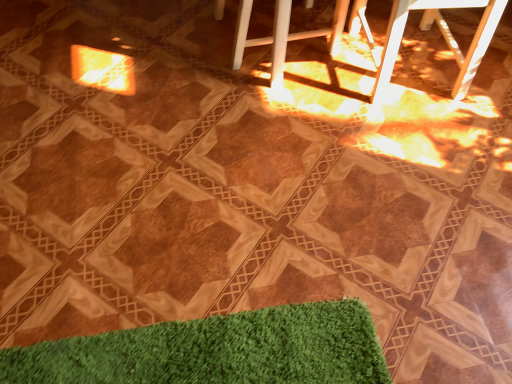
Question: Is white plastic bar stool at center, marked as the 2th bar stool in a right-to-left arrangement, taller or shorter than white plastic bar stool at upper right, placed as the second bar stool when sorted from left to right?

Choices:
 (A) short
 (B) tall

Answer: (A)

Question: Looking at the image, does white plastic bar stool at center, marked as the 2th bar stool in a right-to-left arrangement, seem bigger or smaller compared to white plastic bar stool at upper right, which is the first bar stool from right to left?

Choices:
 (A) big
 (B) small

Answer: (B)

Question: Does point coord(273,36) appear closer or farther from the camera than point coord(449,29)?

Choices:
 (A) farther
 (B) closer

Answer: (B)

Question: From their relative heights in the image, would you say white plastic bar stool at upper right, which is the first bar stool from right to left, is taller or shorter than white plastic bar stool at center, the first bar stool positioned from the left?

Choices:
 (A) short
 (B) tall

Answer: (B)

Question: Is white plastic bar stool at upper right, placed as the second bar stool when sorted from left to right, in front of or behind white plastic bar stool at center, marked as the 2th bar stool in a right-to-left arrangement, in the image?

Choices:
 (A) front
 (B) behind

Answer: (A)

Question: Does point (471, 69) appear closer or farther from the camera than point (278, 24)?

Choices:
 (A) closer
 (B) farther

Answer: (B)

Question: Choose the correct answer: Is white plastic bar stool at upper right, placed as the second bar stool when sorted from left to right, inside white plastic bar stool at center, marked as the 2th bar stool in a right-to-left arrangement, or outside it?

Choices:
 (A) inside
 (B) outside

Answer: (B)